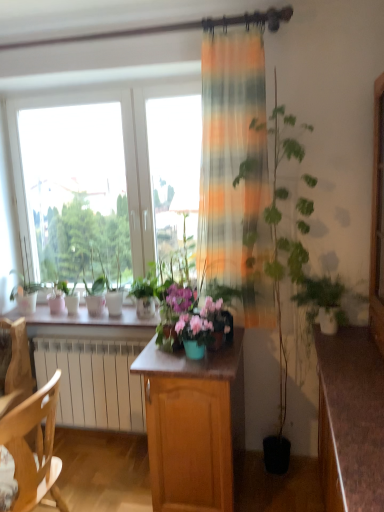
Where is `vacant space situated above brown wood desk at lower right (from a real-world perspective)`? This screenshot has height=512, width=384. vacant space situated above brown wood desk at lower right (from a real-world perspective) is located at coordinates point(360,371).